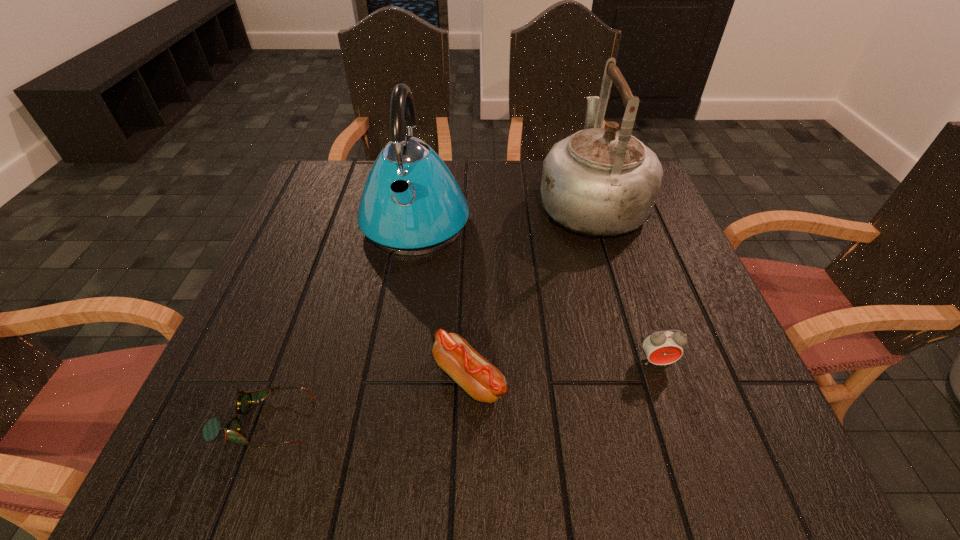
Identify the location of object that is at the left edge. (211, 429).

Where is `kettle that is at the right edge`? kettle that is at the right edge is located at coordinates (599, 181).

Find the location of a particular element. alarm clock located in the right edge section of the desktop is located at coordinates (663, 347).

The height and width of the screenshot is (540, 960). Identify the location of object that is at the near left corner. (211, 429).

The width and height of the screenshot is (960, 540). I want to click on object located at the far right corner, so click(599, 181).

The image size is (960, 540). What are the coordinates of `vacant space at the far edge` in the screenshot? It's located at (480, 167).

Identify the location of blank space at the near edge of the desktop. This screenshot has width=960, height=540. (319, 429).

This screenshot has width=960, height=540. In the image, there is a desktop. What are the coordinates of `free space at the left edge` in the screenshot? It's located at (273, 396).

Locate an element on the screen. This screenshot has height=540, width=960. free space at the right edge of the desktop is located at coordinates (656, 225).

In the image, there is a desktop. Identify the location of vacant area at the far left corner. (319, 195).